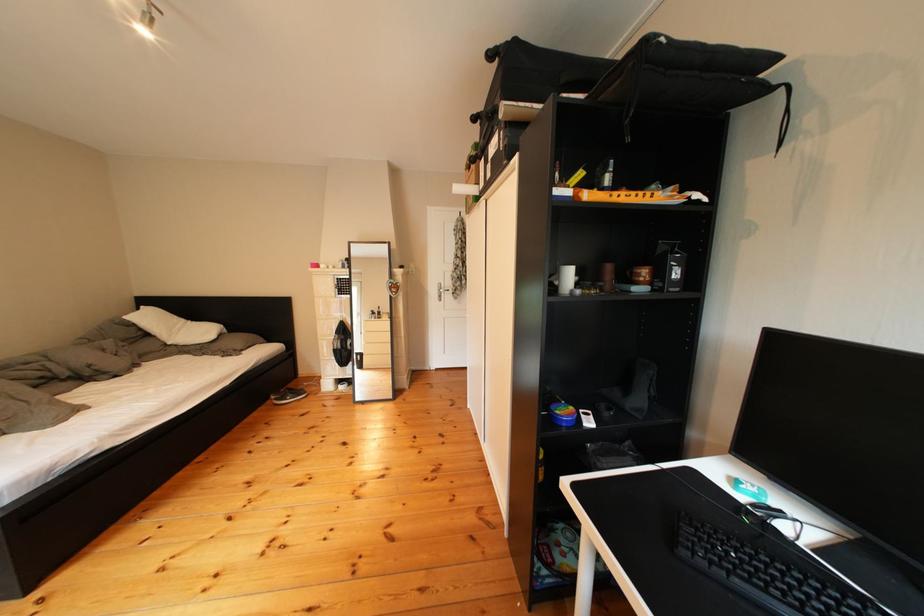
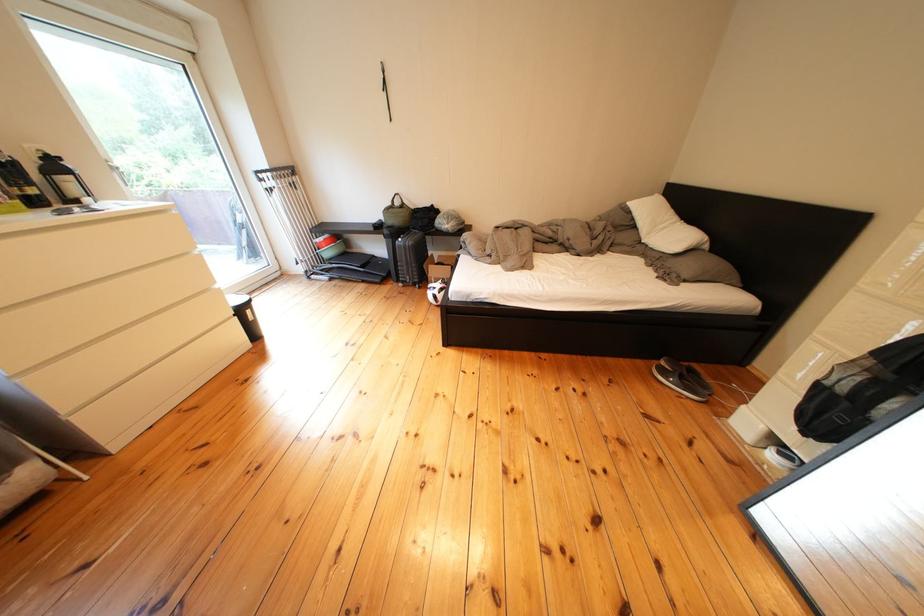
The point at (x=287, y=402) is marked in the first image. Where is the corresponding point in the second image?

(676, 368)